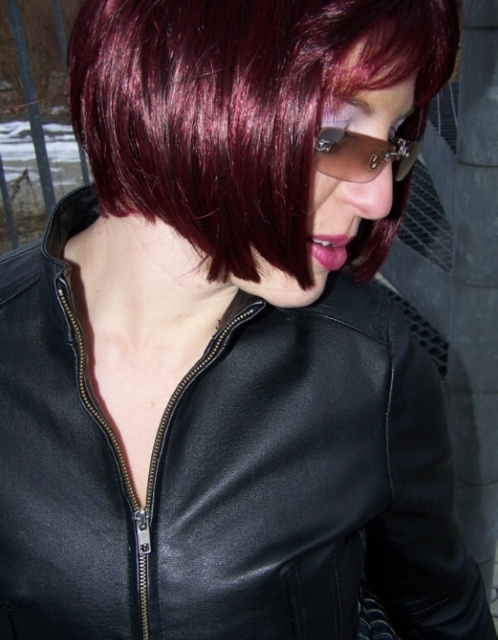
You are a photographer standing 12 inches away from the shiny burgundy hair at center. Can you capture the entire hair in one frame without moving closer?

The shiny burgundy hair at center is 14.36 inches away from the viewer. Since you are standing 12 inches away, you are closer than the specified distance, so you can capture the entire hair in one frame without moving closer.

You are a photographer trying to capture a portrait of the person in the scene. You want to ensure that both the shiny burgundy hair at center and the sunglasses at center are clearly visible in the frame. Based on their positions, which object should you focus on first to ensure both are in focus?

Since the shiny burgundy hair at center is to the left of sunglasses at center, you should focus on the sunglasses at center first, as it is closer to the camera. This will ensure both objects remain in focus due to the overlapping depth of field.